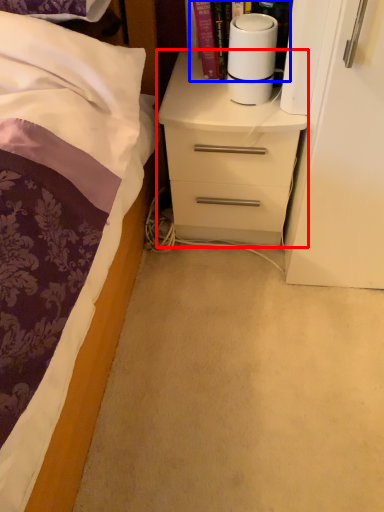
Question: Among these objects, which one is nearest to the camera, chest of drawers (highlighted by a red box) or book (highlighted by a blue box)?

Choices:
 (A) chest of drawers
 (B) book

Answer: (B)